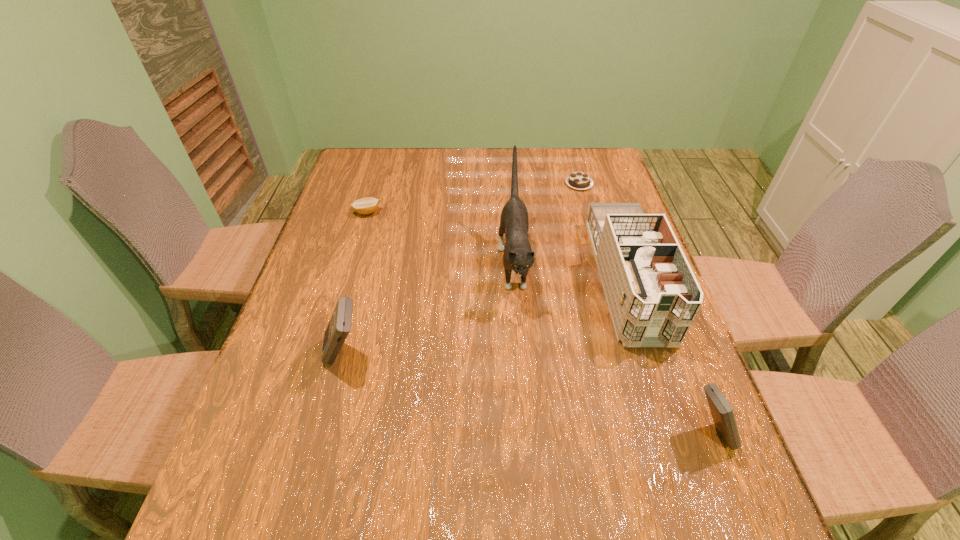
At what (x,y) coordinates should I click in order to perform the action: click on vacant space in between the dollhouse and the left calculator. Please return your answer as a coordinate pair (x, y). This screenshot has height=540, width=960. Looking at the image, I should click on (486, 317).

Locate which object ranks third in proximity to the farther calculator. Please provide its 2D coordinates. Your answer should be formatted as a tuple, i.e. [(x, y)], where the tuple contains the x and y coordinates of a point satisfying the conditions above.

[(653, 296)]

You are a GUI agent. You are given a task and a screenshot of the screen. Output one action in this format:
    pyautogui.click(x=<x>, y=<y>)
    Task: Click on the second closest object relative to the chocolate cake
    
    Given the screenshot: What is the action you would take?
    pyautogui.click(x=518, y=256)

Identify the location of free space that satisfies the following two spatial constraints: 1. at the face of the tallest object; 2. on the front-facing side of the left calculator. (521, 355).

What are the coordinates of `vacant space that satisfies the following two spatial constraints: 1. at the face of the cat; 2. on the front-facing side of the left calculator` in the screenshot? It's located at (521, 355).

The image size is (960, 540). I want to click on vacant position in the image that satisfies the following two spatial constraints: 1. at the entrance of the dollhouse; 2. on the front-facing side of the taller calculator, so click(x=652, y=355).